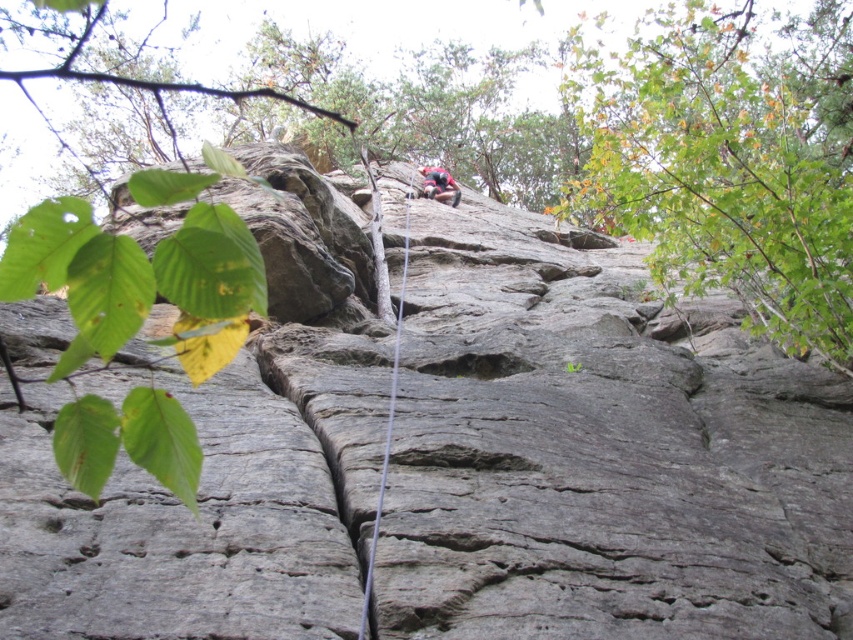
Question: Which point is closer to the camera taking this photo?

Choices:
 (A) (828, 108)
 (B) (202, 227)

Answer: (B)

Question: Is green leafy branch at upper left to the right of reddish-brown climbing gear at center from the viewer's perspective?

Choices:
 (A) no
 (B) yes

Answer: (A)

Question: Where is green leafy tree at upper right located in relation to gray/rough rope at center in the image?

Choices:
 (A) right
 (B) left

Answer: (A)

Question: Is green leafy branch at upper left above gray/rough rope at center?

Choices:
 (A) no
 (B) yes

Answer: (B)

Question: Which object appears closest to the camera in this image?

Choices:
 (A) reddish-brown climbing gear at center
 (B) green leafy tree at upper right

Answer: (B)

Question: Among these objects, which one is nearest to the camera?

Choices:
 (A) green leafy tree at upper right
 (B) green leafy branch at upper left
 (C) gray/rough rope at center

Answer: (B)